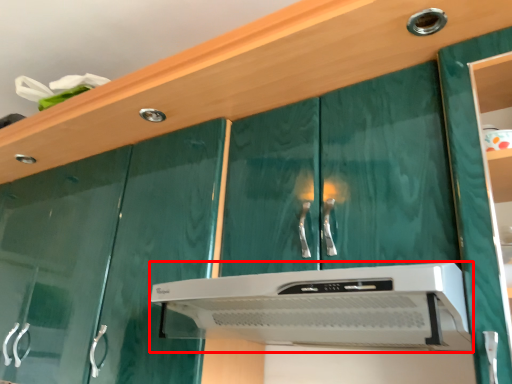
Question: From the image's perspective, where is home appliance (annotated by the red box) located in relation to knob in the image?

Choices:
 (A) below
 (B) above

Answer: (A)